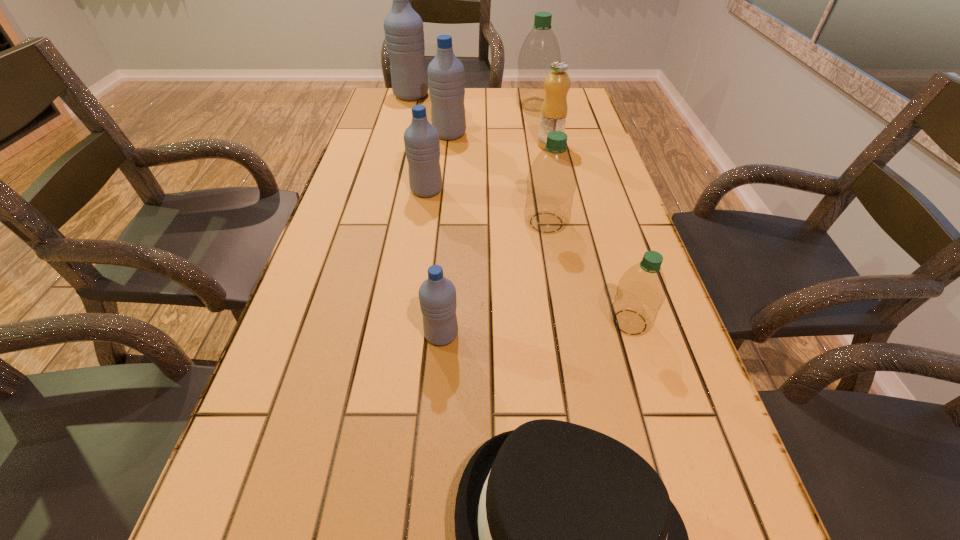
The height and width of the screenshot is (540, 960). I want to click on vacant space situated on the back of the smallest blue water bottle, so click(448, 245).

Locate an element on the screen. vacant space located 0.140m on the front of the nearest green water bottle is located at coordinates (656, 404).

Find the location of `object situated at the left edge`. object situated at the left edge is located at coordinates (403, 27).

Locate an element on the screen. Image resolution: width=960 pixels, height=540 pixels. fruit juice present at the right edge is located at coordinates (553, 116).

Image resolution: width=960 pixels, height=540 pixels. Find the location of `object present at the far left corner`. object present at the far left corner is located at coordinates (403, 27).

Where is `object present at the far right corner`? object present at the far right corner is located at coordinates (540, 49).

This screenshot has width=960, height=540. I want to click on vacant region at the far edge, so click(430, 113).

In order to click on vacant space at the left edge of the desktop in this screenshot , I will do `click(392, 156)`.

You are a GUI agent. You are given a task and a screenshot of the screen. Output one action in this format:
    pyautogui.click(x=<x>, y=<y>)
    Task: Click on the vacant space at the right edge of the desktop
    This screenshot has height=540, width=960.
    Given the screenshot: What is the action you would take?
    pyautogui.click(x=595, y=315)

You are a GUI agent. You are given a task and a screenshot of the screen. Output one action in this format:
    pyautogui.click(x=<x>, y=<y>)
    Task: Click on the vacant space that's between the fifth farthest object and the second nearest green water bottle
    This screenshot has height=540, width=960.
    Given the screenshot: What is the action you would take?
    pyautogui.click(x=487, y=207)